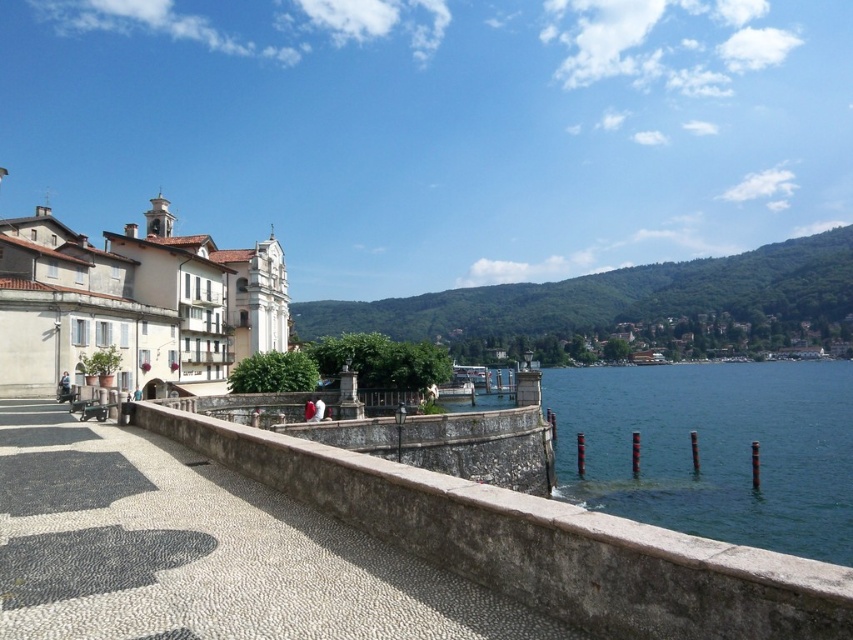
Question: Based on their relative distances, which object is farther from the greenish-blue water at lower right?

Choices:
 (A) gray stone path at center
 (B) white stone buildings at left

Answer: (A)

Question: Is greenish-blue water at lower right positioned behind white stone buildings at left?

Choices:
 (A) no
 (B) yes

Answer: (A)

Question: Considering the relative positions of gray stone path at center and white stone buildings at left in the image provided, where is gray stone path at center located with respect to white stone buildings at left?

Choices:
 (A) left
 (B) right

Answer: (B)

Question: Which of these objects is positioned closest to the white stone buildings at left?

Choices:
 (A) greenish-blue water at lower right
 (B) gray stone path at center

Answer: (B)

Question: Which object is positioned farthest from the white stone buildings at left?

Choices:
 (A) greenish-blue water at lower right
 (B) gray stone path at center

Answer: (A)

Question: Is gray stone path at center wider than greenish-blue water at lower right?

Choices:
 (A) no
 (B) yes

Answer: (A)